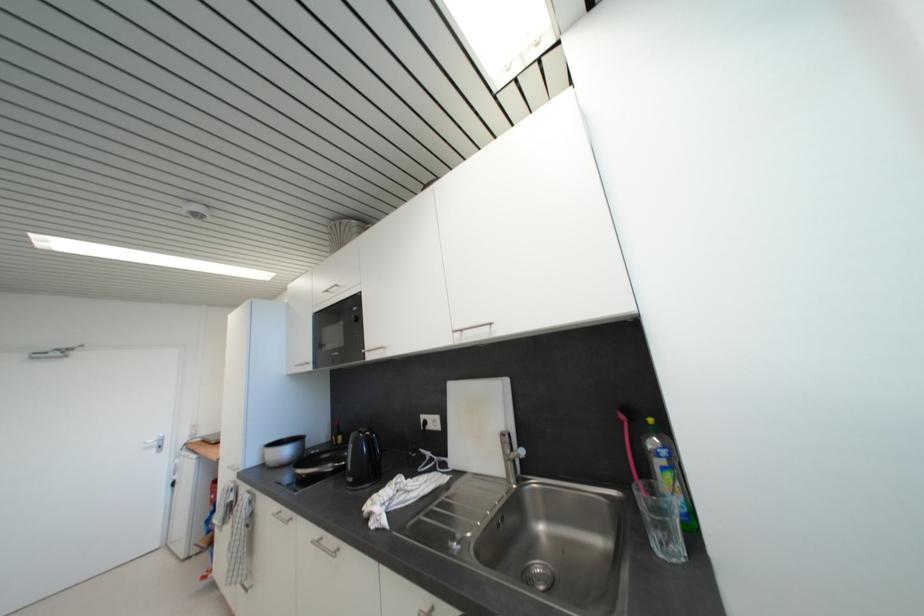
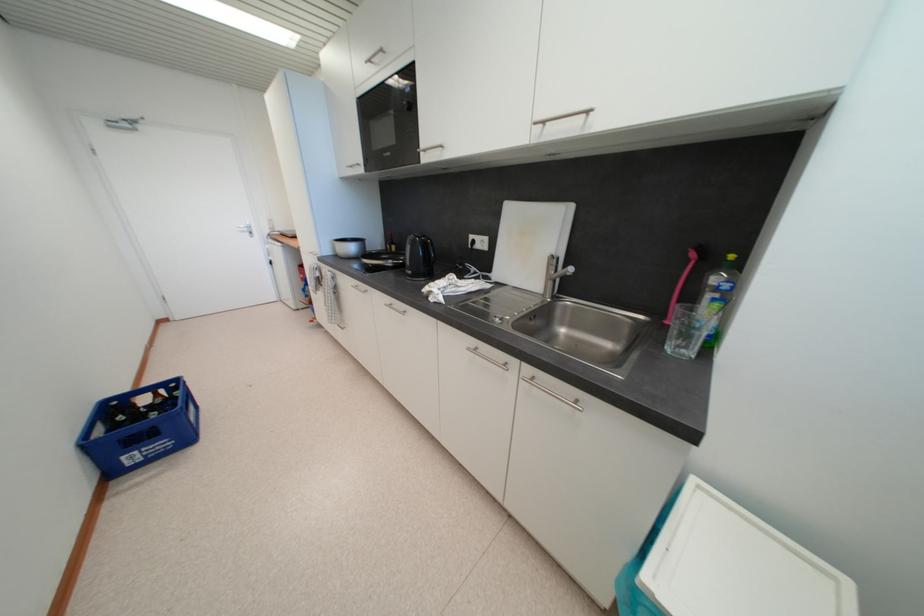
Find the pixel in the second image that matches point (332, 294) in the first image.

(375, 63)